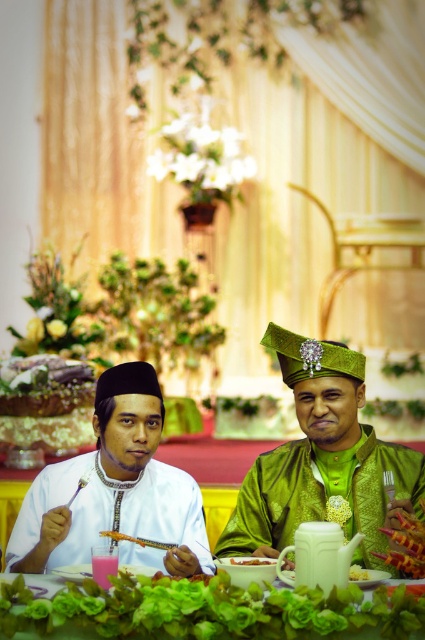
Is point (252, 577) farther from viewer compared to point (354, 577)?

No, (252, 577) is in front of (354, 577).

Which is in front, point (257, 579) or point (354, 577)?

Point (257, 579)

What do you see at coordinates (248, 570) in the screenshot? I see `smooth white bowl at center` at bounding box center [248, 570].

Locate an element on the screen. The height and width of the screenshot is (640, 425). smooth white bowl at center is located at coordinates (248, 570).

Can you confirm if green satin turban at center is positioned to the left of orange textured food at center?

No, green satin turban at center is not to the left of orange textured food at center.

Is green satin turban at center taller than orange textured food at center?

Yes.

This screenshot has height=640, width=425. What are the coordinates of `green satin turban at center` in the screenshot? It's located at (323, 460).

Is green satin turban at center positioned behind smooth white bowl at center?

Yes, it is behind smooth white bowl at center.

Is green satin turban at center thinner than smooth white bowl at center?

In fact, green satin turban at center might be wider than smooth white bowl at center.

Who is more forward, (317, 355) or (246, 588)?

Point (246, 588) is in front.

Identify the location of green satin turban at center. (323, 460).